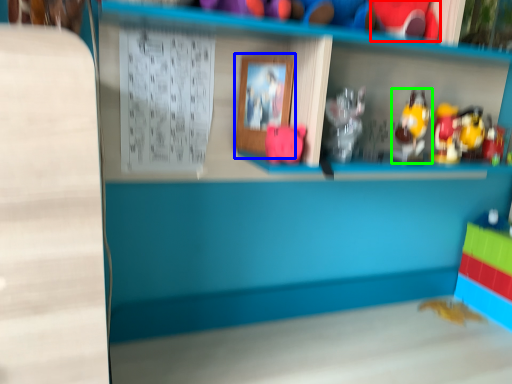
Question: Based on their relative distances, which object is farther from toy (highlighted by a red box)? Choose from picture frame (highlighted by a blue box) and toy (highlighted by a green box).

Choices:
 (A) picture frame
 (B) toy

Answer: (A)